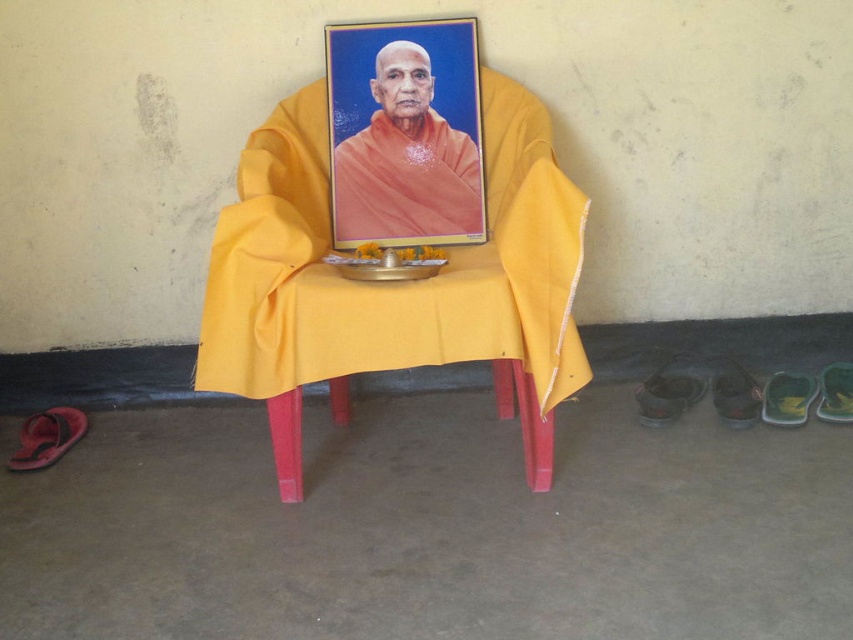
Can you confirm if yellow fabric-covered chair at center is shorter than orange clothed monk at center?

In fact, yellow fabric-covered chair at center may be taller than orange clothed monk at center.

Does yellow fabric-covered chair at center come behind orange clothed monk at center?

No, yellow fabric-covered chair at center is closer to the viewer.

Find the location of a particular element. The width and height of the screenshot is (853, 640). yellow fabric-covered chair at center is located at coordinates (395, 284).

The height and width of the screenshot is (640, 853). Find the location of `yellow fabric-covered chair at center`. yellow fabric-covered chair at center is located at coordinates (395, 284).